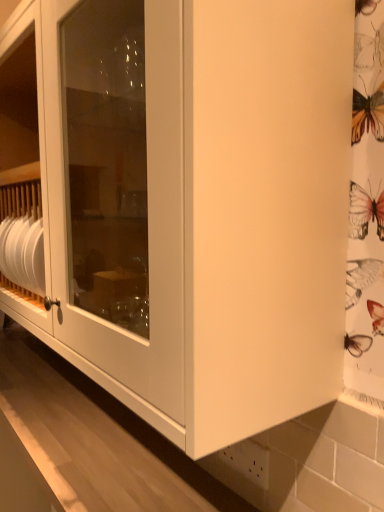
Where is `vacant space to the left of white glossy tile at lower right`? vacant space to the left of white glossy tile at lower right is located at coordinates (172, 472).